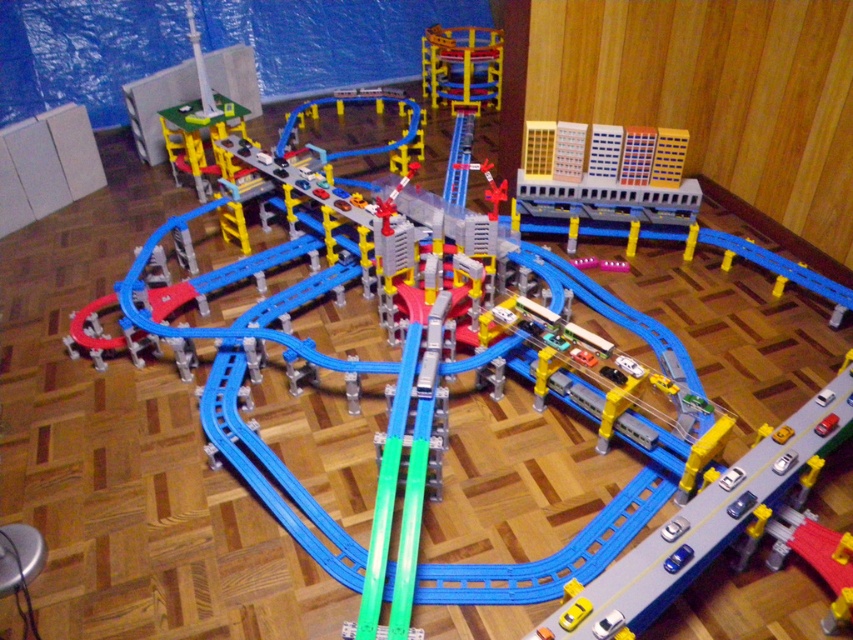
Is yellow plastic building at upper right to the left of metallic blue train car at upper center from the viewer's perspective?

No, yellow plastic building at upper right is not to the left of metallic blue train car at upper center.

Between yellow plastic building at upper right and metallic blue train car at upper center, which one is positioned lower?

yellow plastic building at upper right

Is point (582, 193) closer to viewer compared to point (431, 40)?

Yes.

This screenshot has height=640, width=853. Find the location of `yellow plastic building at upper right`. yellow plastic building at upper right is located at coordinates (606, 180).

This screenshot has width=853, height=640. What are the coordinates of `metallic silver train at center` in the screenshot? It's located at (706, 522).

In the scene shown: Can you confirm if metallic silver train at center is positioned to the left of yellow plastic building at upper right?

Correct, you'll find metallic silver train at center to the left of yellow plastic building at upper right.

Is point (581, 589) positioned after point (599, 182)?

That is False.

I want to click on metallic silver train at center, so click(x=706, y=522).

How much distance is there between metallic silver train at center and metallic blue train car at upper center?

metallic silver train at center and metallic blue train car at upper center are 9.08 feet apart from each other.

Which is more to the right, metallic silver train at center or metallic blue train car at upper center?

metallic silver train at center

This screenshot has width=853, height=640. Describe the element at coordinates (706, 522) in the screenshot. I see `metallic silver train at center` at that location.

The width and height of the screenshot is (853, 640). I want to click on metallic silver train at center, so click(706, 522).